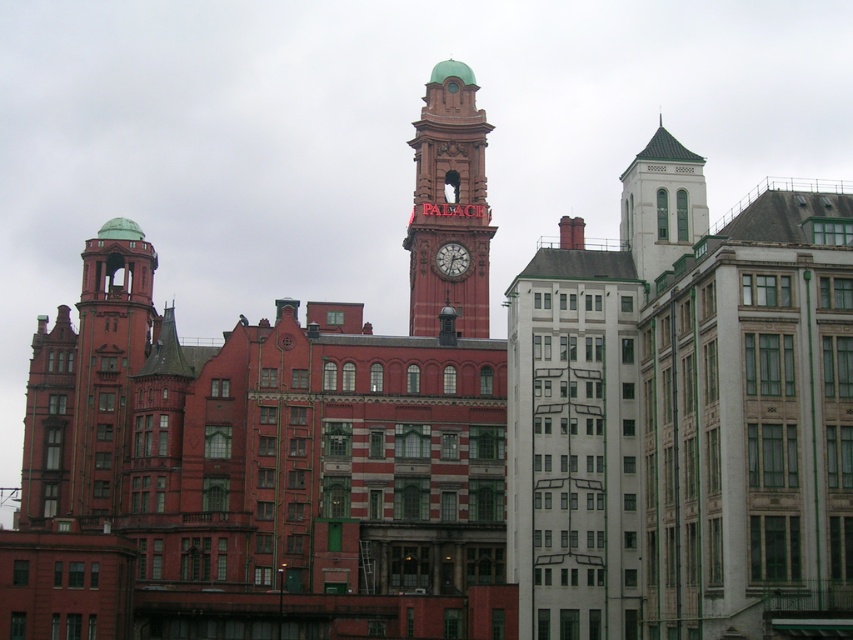
Question: Among these points, which one is nearest to the camera?

Choices:
 (A) (585, 508)
 (B) (459, 260)
 (C) (682, 188)
 (D) (140, 355)

Answer: (A)

Question: Is white smooth building at center-right positioned at the back of white glass tower at upper right?

Choices:
 (A) no
 (B) yes

Answer: (A)

Question: Which of the following is the farthest from the observer?

Choices:
 (A) matte red clock tower at center
 (B) white smooth building at center-right
 (C) matte red tower at left
 (D) white glass tower at upper right

Answer: (C)

Question: Does matte red tower at left appear over matte red clock at center?

Choices:
 (A) no
 (B) yes

Answer: (A)

Question: Is matte red tower at left wider than matte red clock at center?

Choices:
 (A) no
 (B) yes

Answer: (B)

Question: Estimate the real-world distances between objects in this image. Which object is closer to the matte red clock tower at center?

Choices:
 (A) white glass tower at upper right
 (B) white smooth building at center-right

Answer: (A)